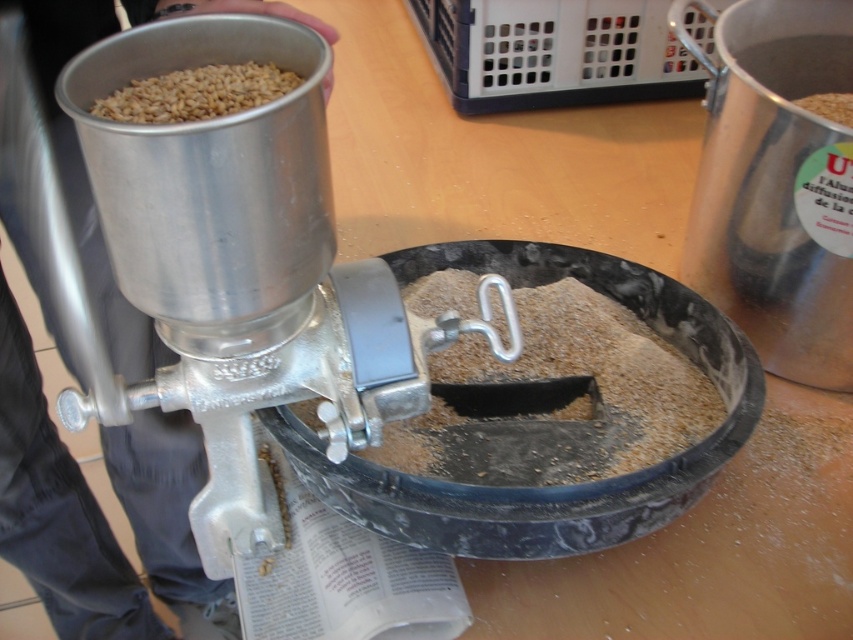
Identify the location of brown matte grain at center. (556, 397).

Locate an element on the screen. brown matte grain at center is located at coordinates (556, 397).